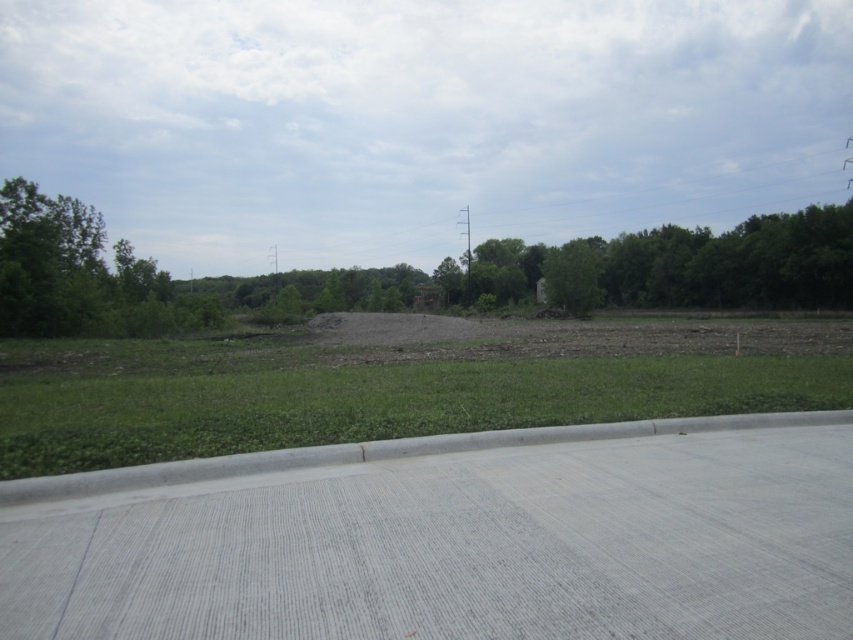
Who is positioned more to the left, green grass at center or brown soil at center?

Positioned to the left is green grass at center.

Between point (312, 368) and point (601, 328), which one is positioned in front?

Positioned in front is point (312, 368).

Image resolution: width=853 pixels, height=640 pixels. Identify the location of green grass at center. coord(358,400).